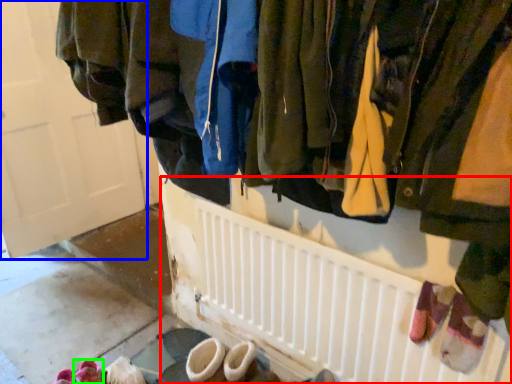
Question: Which object is positioned closest to radiator (highlighted by a red box)? Select from door (highlighted by a blue box) and footwear (highlighted by a green box).

Choices:
 (A) door
 (B) footwear

Answer: (B)